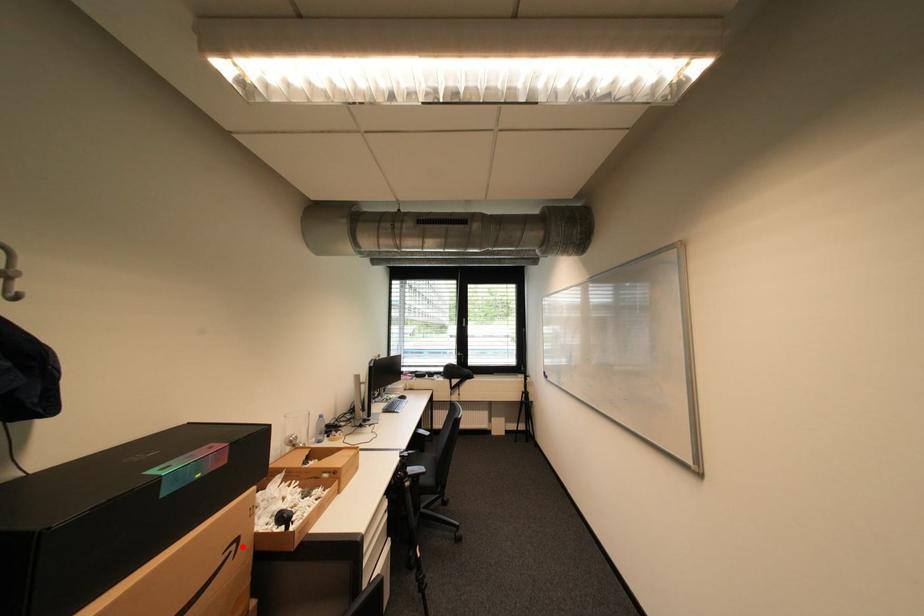
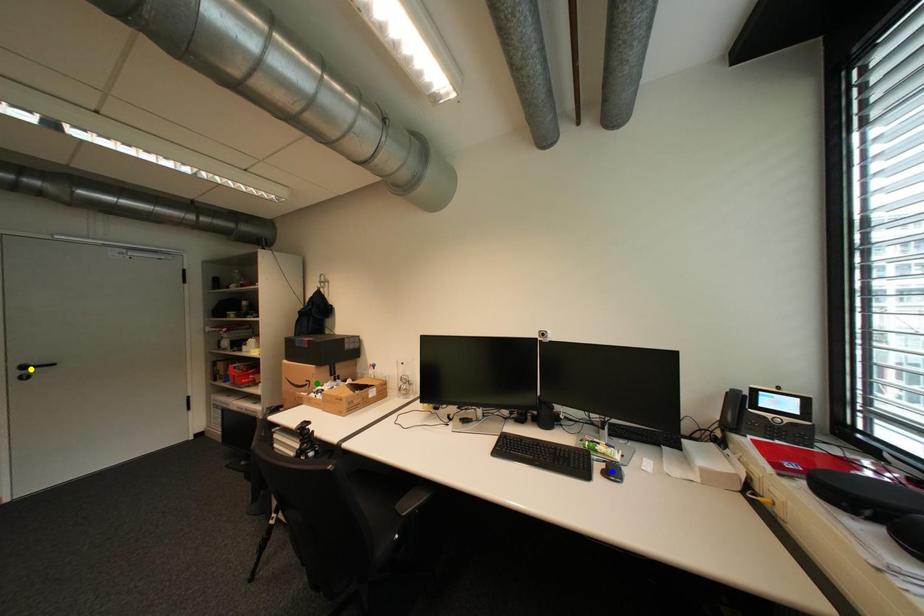
Question: I am providing you with two images of the same scene from different viewpoints. A red point is marked on the first image. You are given multiple points on the second image. Which spot in image 2 lines up with the point in image 1?

Choices:
 (A) green point
 (B) blue point
 (C) yellow point

Answer: (A)